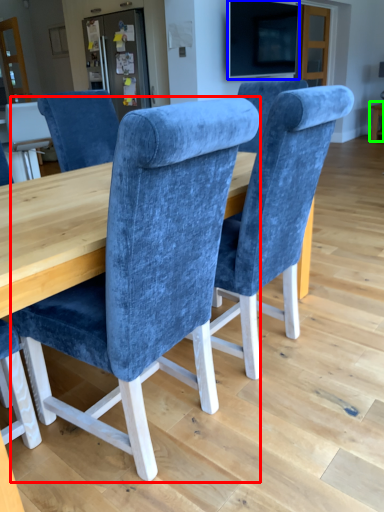
Question: Based on their relative distances, which object is farther from chair (highlighted by a red box)? Choose from television (highlighted by a blue box) and table (highlighted by a green box).

Choices:
 (A) television
 (B) table

Answer: (B)